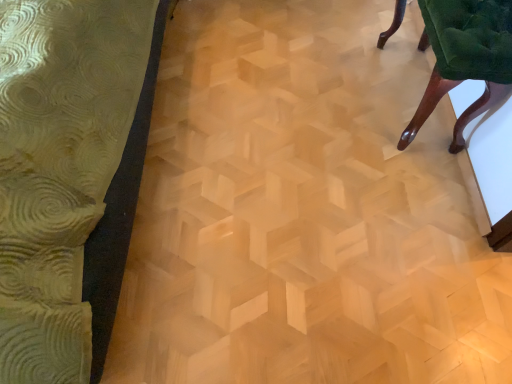
Describe the element at coordinates (465, 59) in the screenshot. I see `velvet green chair at upper right` at that location.

The image size is (512, 384). In order to click on velvet green chair at upper right in this screenshot , I will do `click(465, 59)`.

Where is `velvet green chair at upper right`? This screenshot has width=512, height=384. velvet green chair at upper right is located at coordinates (465, 59).